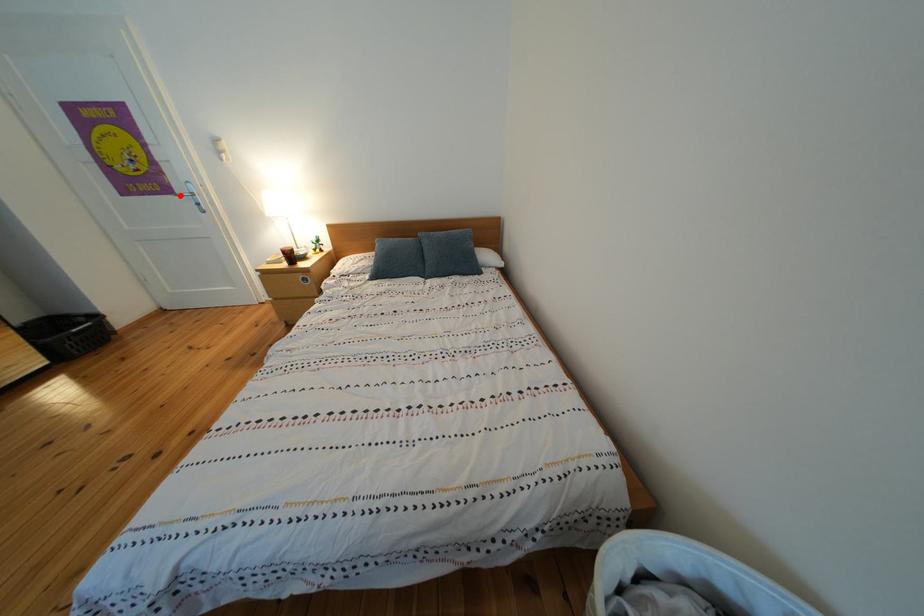
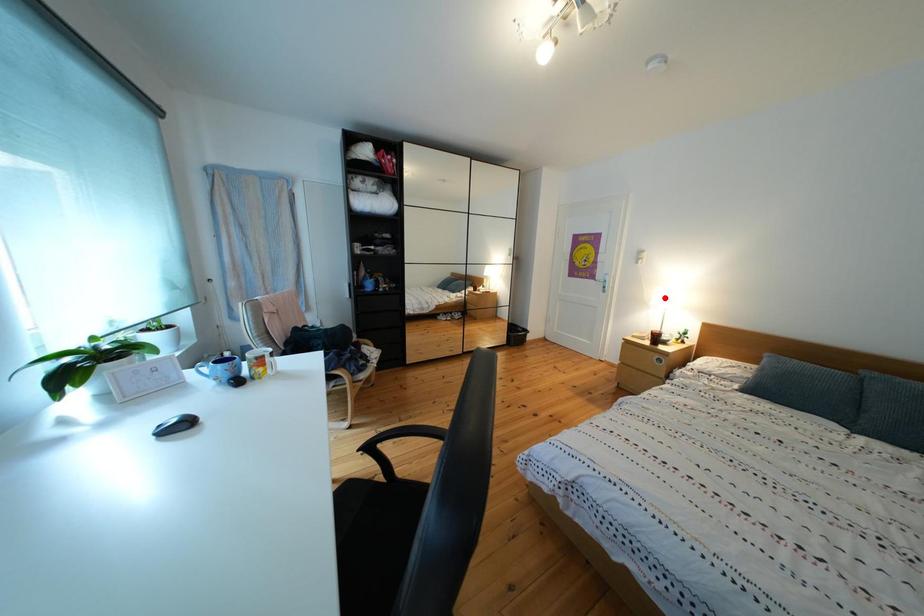
I am providing you with two images of the same scene from different viewpoints. A red point is marked on the first image and another point is marked on the second image. Is the red point in image1 aligned with the point shown in image2?

No